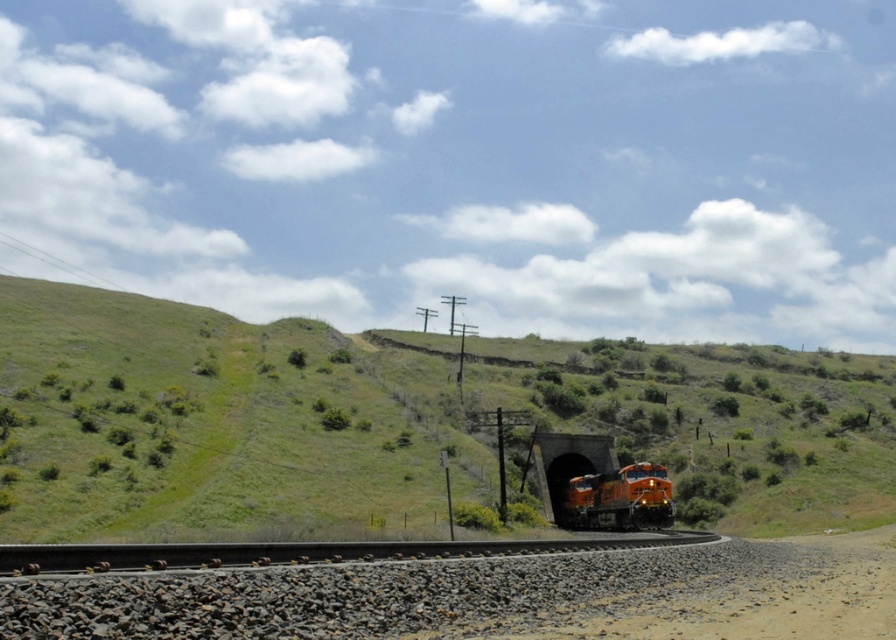
You are a railway worker standing on the dirt path on the right side of the tracks. You need to inspect the orange metallic train at lower center and the dark gray concrete tunnel at center. From your position, which object is closer to your right side?

The orange metallic train at lower center is positioned on the right side of dark gray concrete tunnel at center, so from your position on the dirt path on the right side of the tracks, the orange metallic train at lower center is closer to your right side.

You are a railway worker standing on the gravelly railway track and you see the brown gravel dirt track at lower center and the orange metallic train at lower center. Which object is closer to you?

The brown gravel dirt track at lower center is closer to you because it is positioned in front of the orange metallic train at lower center.